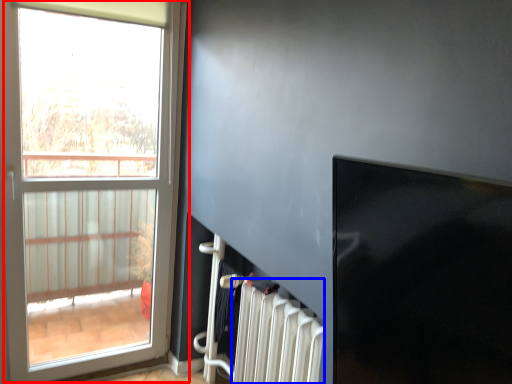
Question: Which object appears farthest to the camera in this image, window (highlighted by a red box) or radiator (highlighted by a blue box)?

Choices:
 (A) window
 (B) radiator

Answer: (A)